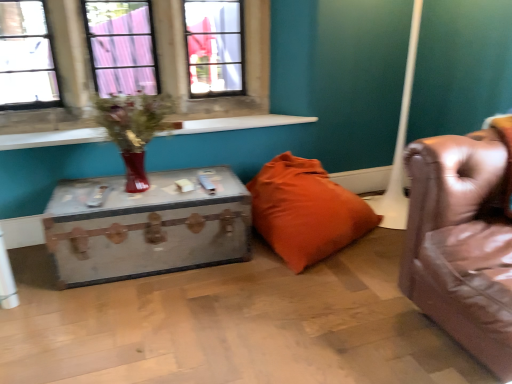
Locate an element on the screen. free space in front of rustic wood trunk at center is located at coordinates (140, 324).